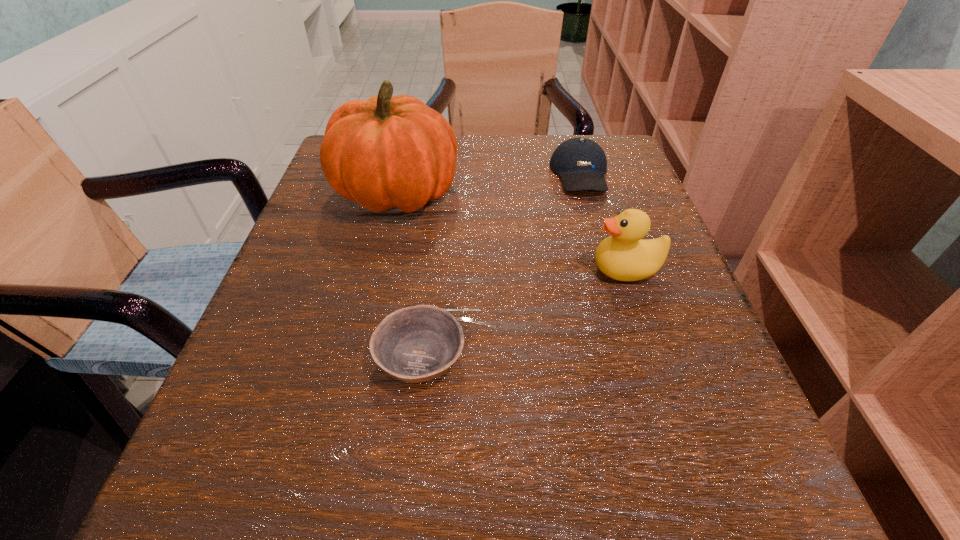
The width and height of the screenshot is (960, 540). I want to click on free location located on the front-facing side of the third tallest object, so click(594, 221).

Locate an element on the screen. Image resolution: width=960 pixels, height=540 pixels. free location located on the front of the shortest object is located at coordinates (404, 496).

The width and height of the screenshot is (960, 540). I want to click on pumpkin that is at the far edge, so click(x=388, y=151).

Where is `baseball cap that is at the far edge`? baseball cap that is at the far edge is located at coordinates (581, 163).

You are a GUI agent. You are given a task and a screenshot of the screen. Output one action in this format:
    pyautogui.click(x=<x>, y=<y>)
    Task: Click on the object that is positioned at the left edge
    This screenshot has height=540, width=960.
    Given the screenshot: What is the action you would take?
    pyautogui.click(x=388, y=151)

Where is `duck at the right edge`? The width and height of the screenshot is (960, 540). duck at the right edge is located at coordinates (623, 256).

The height and width of the screenshot is (540, 960). In order to click on baseball cap situated at the right edge in this screenshot , I will do `click(581, 163)`.

This screenshot has width=960, height=540. I want to click on object present at the far left corner, so click(388, 151).

Identify the location of object that is at the far right corner. The width and height of the screenshot is (960, 540). (581, 163).

Where is `free region at the far edge`? free region at the far edge is located at coordinates (462, 177).